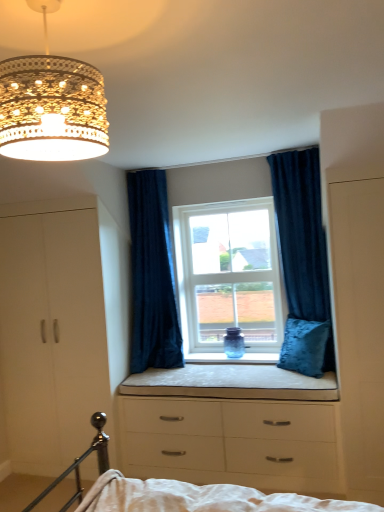
How much space does velvet dark blue curtain at center, placed as the 2th curtain when sorted from right to left, occupy vertically?

It is 5.43 feet.

What do you see at coordinates (152, 275) in the screenshot? I see `velvet dark blue curtain at center, placed as the 2th curtain when sorted from right to left` at bounding box center [152, 275].

In order to face white matte wardrobe at right, should I rotate leftwards or rightwards?

Turn right by 22.489 degrees to look at white matte wardrobe at right.

Locate an element on the screen. velvet blue pillow at center is located at coordinates (304, 346).

This screenshot has width=384, height=512. Find the location of `velvet blue curtain at upper right, which is counted as the 2th curtain, starting from the left`. velvet blue curtain at upper right, which is counted as the 2th curtain, starting from the left is located at coordinates (301, 233).

Locate an element on the screen. gold crystal chandelier at upper left is located at coordinates (51, 104).

Is the depth of white glass window at center greater than that of beige fabric cushion at center?

Yes, it is.

Which object is positioned more to the right, white glass window at center or beige fabric cushion at center?

Positioned to the right is white glass window at center.

How far apart are white glass window at center and beige fabric cushion at center?

white glass window at center is 25.87 inches away from beige fabric cushion at center.

Is white glass window at center outside of beige fabric cushion at center?

That's correct, white glass window at center is outside of beige fabric cushion at center.

How distant is velvet blue curtain at upper right, which is counted as the 2th curtain, starting from the left, from gold crystal chandelier at upper left?

velvet blue curtain at upper right, which is counted as the 2th curtain, starting from the left, is 2.28 meters from gold crystal chandelier at upper left.

Is point (305, 308) closer or farther from the camera than point (18, 104)?

Point (305, 308).

Based on the photo, from the image's perspective, is velvet blue curtain at upper right, which appears as the 1th curtain when viewed from the right, located beneath gold crystal chandelier at upper left?

Correct, velvet blue curtain at upper right, which appears as the 1th curtain when viewed from the right, appears lower than gold crystal chandelier at upper left in the image.

Is velvet blue curtain at upper right, which is counted as the 2th curtain, starting from the left, to the left of gold crystal chandelier at upper left from the viewer's perspective?

Incorrect, velvet blue curtain at upper right, which is counted as the 2th curtain, starting from the left, is not on the left side of gold crystal chandelier at upper left.

Is velvet blue pillow at center spatially inside gold crystal chandelier at upper left, or outside of it?

velvet blue pillow at center exists outside the volume of gold crystal chandelier at upper left.

From a real-world perspective, is velvet blue pillow at center positioned over gold crystal chandelier at upper left based on gravity?

No, from a real-world perspective, velvet blue pillow at center is not above gold crystal chandelier at upper left.

Image resolution: width=384 pixels, height=512 pixels. I want to click on lamp in front of the velvet blue pillow at center, so tap(51, 104).

What's the angular difference between white matte wardrobe at right and beige fabric cushion at center's facing directions?

They differ by 0.214 degrees in their facing directions.

Where is `side above the beige fabric cushion at center (from the image's perspective)`? This screenshot has width=384, height=512. side above the beige fabric cushion at center (from the image's perspective) is located at coordinates (357, 286).

Which is in front, point (373, 486) or point (179, 388)?

Positioned in front is point (373, 486).

At what (x,y) coordinates should I click in order to perform the action: click on pillow that appears below the velvet dark blue curtain at center, placed as the 2th curtain when sorted from right to left (from a real-world perspective). Please return your answer as a coordinate pair (x, y). Looking at the image, I should click on (304, 346).

From a real-world perspective, is velvet dark blue curtain at center, acting as the first curtain starting from the left, positioned under velvet blue pillow at center based on gravity?

No, from a real-world perspective, velvet dark blue curtain at center, acting as the first curtain starting from the left, is not below velvet blue pillow at center.

Between point (139, 190) and point (311, 333), which one is positioned in front?

The point (311, 333) is in front.

From the image's perspective, is white glass window at center above or below white matte chest of drawers at lower center?

white glass window at center is situated higher than white matte chest of drawers at lower center in the image.

Looking at their sizes, would you say white glass window at center is wider or thinner than white matte chest of drawers at lower center?

In the image, white glass window at center appears to be more narrow than white matte chest of drawers at lower center.

Between white glass window at center and white matte chest of drawers at lower center, which one appears on the right side from the viewer's perspective?

→ Positioned to the right is white glass window at center.

How distant is velvet blue pillow at center from white matte wardrobe at right?

The distance of velvet blue pillow at center from white matte wardrobe at right is 22.74 inches.

Is velvet blue pillow at center to the left of white matte wardrobe at right from the viewer's perspective?

Indeed, velvet blue pillow at center is positioned on the left side of white matte wardrobe at right.

The height and width of the screenshot is (512, 384). I want to click on side above the velvet blue pillow at center (from a real-world perspective), so click(x=357, y=286).

From a real-world perspective, relative to white matte wardrobe at right, is velvet blue pillow at center vertically above or below?

From a real-world perspective, velvet blue pillow at center is physically below white matte wardrobe at right.

Where is `window sill below the white glass window at center (from a real-world perspective)`? window sill below the white glass window at center (from a real-world perspective) is located at coordinates (231, 383).

At what (x,y) coordinates should I click in order to perform the action: click on curtain that is the 1st one when counting backward from the gold crystal chandelier at upper left. Please return your answer as a coordinate pair (x, y). The height and width of the screenshot is (512, 384). Looking at the image, I should click on (301, 233).

Based on their spatial positions, is velvet blue pillow at center or white glass window at center further from white matte chest of drawers at lower center?

white glass window at center is further to white matte chest of drawers at lower center.

Which object lies further to the anchor point gold crystal chandelier at upper left, beige fabric cushion at center or velvet blue curtain at upper right, which is counted as the 2th curtain, starting from the left?

beige fabric cushion at center is positioned further to the anchor gold crystal chandelier at upper left.

Based on their spatial positions, is beige fabric cushion at center or gold crystal chandelier at upper left further from velvet blue curtain at upper right, which appears as the 1th curtain when viewed from the right?

Based on the image, gold crystal chandelier at upper left appears to be further to velvet blue curtain at upper right, which appears as the 1th curtain when viewed from the right.

Based on their spatial positions, is white glass window at center or gold crystal chandelier at upper left closer to beige fabric cushion at center?

Based on the image, white glass window at center appears to be nearer to beige fabric cushion at center.

Considering their positions, is velvet blue curtain at upper right, which appears as the 1th curtain when viewed from the right, positioned further to white matte chest of drawers at lower center than gold crystal chandelier at upper left?

gold crystal chandelier at upper left is positioned further to the anchor white matte chest of drawers at lower center.

From the image, which object appears to be nearer to white matte chest of drawers at lower center, white matte wardrobe at right or beige fabric cushion at center?

beige fabric cushion at center is closer to white matte chest of drawers at lower center.

Estimate the real-world distances between objects in this image. Which object is closer to gold crystal chandelier at upper left, velvet blue curtain at upper right, which is counted as the 2th curtain, starting from the left, or white matte chest of drawers at lower center?

velvet blue curtain at upper right, which is counted as the 2th curtain, starting from the left, is closer to gold crystal chandelier at upper left.

When comparing their distances from white matte wardrobe at right, does velvet blue pillow at center or velvet dark blue curtain at center, acting as the first curtain starting from the left, seem further?

velvet dark blue curtain at center, acting as the first curtain starting from the left.

I want to click on dresser between gold crystal chandelier at upper left and velvet blue curtain at upper right, which is counted as the 2th curtain, starting from the left, along the z-axis, so click(x=60, y=329).

Where is `chest of drawers between beige fabric cushion at center and velvet blue pillow at center`? chest of drawers between beige fabric cushion at center and velvet blue pillow at center is located at coordinates (228, 431).

Identify the location of side between white glass window at center and white matte chest of drawers at lower center vertically. Image resolution: width=384 pixels, height=512 pixels. (357, 286).

This screenshot has width=384, height=512. In order to click on side between gold crystal chandelier at upper left and white matte dresser at left along the z-axis in this screenshot , I will do `click(357, 286)`.